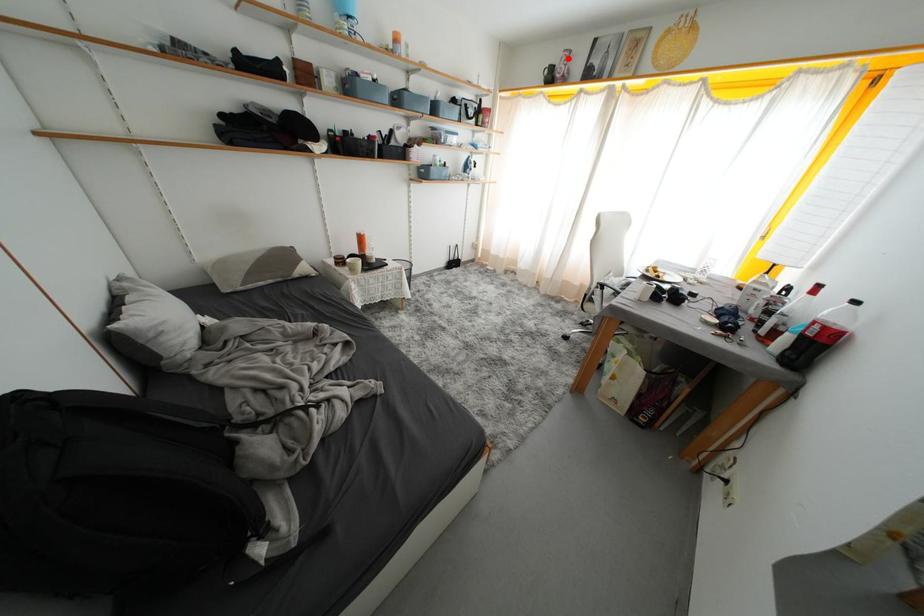
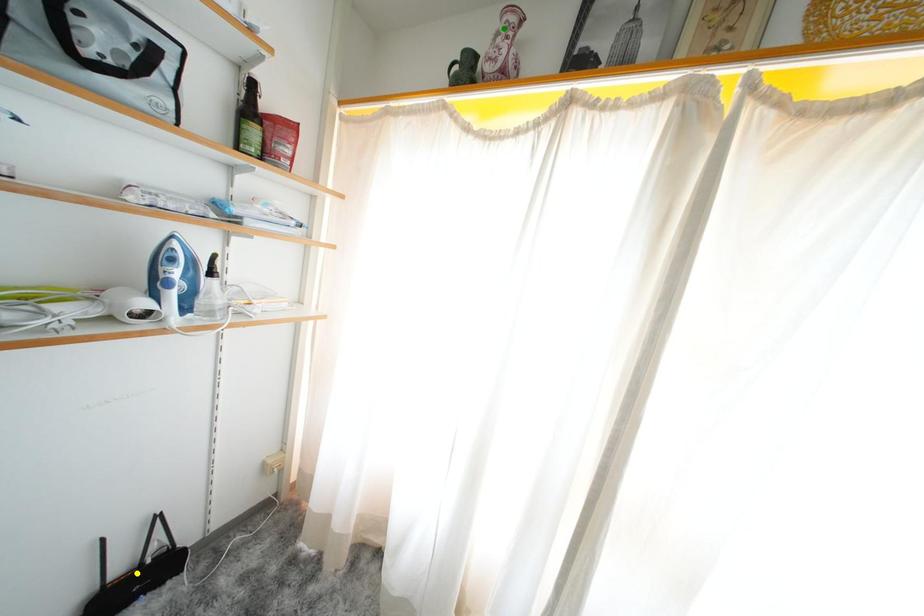
Question: I am providing you with two images of the same scene from different viewpoints. A red point is marked on the first image. You are given multiple points on the second image. Can you choose the point in image 2 that corresponds to the point in image 1?

Choices:
 (A) green point
 (B) blue point
 (C) yellow point

Answer: (A)